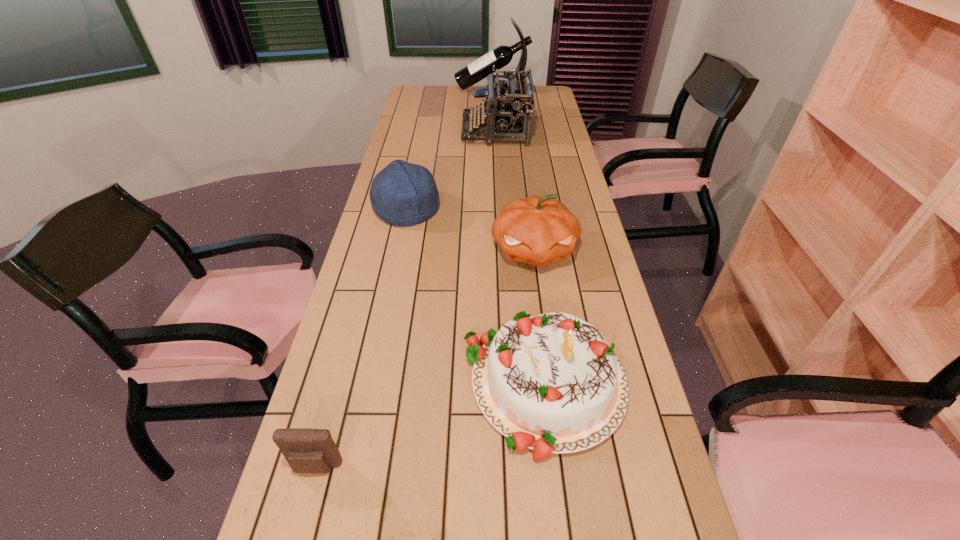
Locate an element on the screen. The width and height of the screenshot is (960, 540). free region that satisfies the following two spatial constraints: 1. on the typing side of the typewriter; 2. on the left side of the cake is located at coordinates (511, 384).